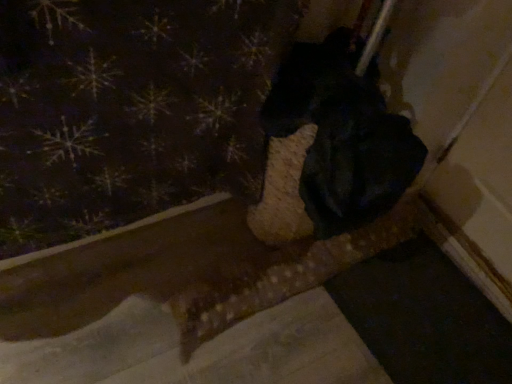
Question: From the image's perspective, is dark fabric with snowflake pattern at upper left located above or below black matte dog at center?

Choices:
 (A) below
 (B) above

Answer: (B)

Question: Is point (228, 16) positioned closer to the camera than point (351, 162)?

Choices:
 (A) closer
 (B) farther

Answer: (B)

Question: Based on their positions, is dark fabric with snowflake pattern at upper left located to the left or right of black matte dog at center?

Choices:
 (A) left
 (B) right

Answer: (A)

Question: Considering the positions of black matte dog at center and dark fabric with snowflake pattern at upper left in the image, is black matte dog at center taller or shorter than dark fabric with snowflake pattern at upper left?

Choices:
 (A) short
 (B) tall

Answer: (A)

Question: From a real-world perspective, is black matte dog at center positioned above or below dark fabric with snowflake pattern at upper left?

Choices:
 (A) above
 (B) below

Answer: (B)

Question: Is black matte dog at center in front of or behind dark fabric with snowflake pattern at upper left in the image?

Choices:
 (A) front
 (B) behind

Answer: (B)

Question: Does point (365, 112) appear closer or farther from the camera than point (230, 43)?

Choices:
 (A) farther
 (B) closer

Answer: (B)